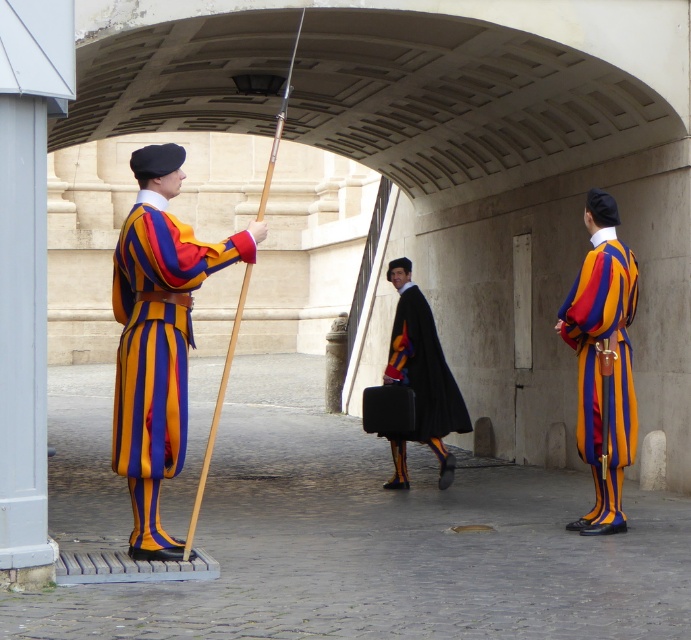
Question: Which point is farther from the camera taking this photo?

Choices:
 (A) (615, 316)
 (B) (117, 474)
 (C) (404, 307)

Answer: (C)

Question: Is striped wool uniform at center above black velvet cape at center?

Choices:
 (A) no
 (B) yes

Answer: (A)

Question: Does striped wool uniform at center have a smaller size compared to striped wool coat at right?

Choices:
 (A) yes
 (B) no

Answer: (A)

Question: Which point is closer to the camera taking this photo?

Choices:
 (A) (577, 348)
 (B) (153, 436)

Answer: (B)

Question: Does striped wool uniform at center have a smaller size compared to striped wool coat at right?

Choices:
 (A) yes
 (B) no

Answer: (A)

Question: Which is nearer to the striped wool uniform at center?

Choices:
 (A) striped wool coat at right
 (B) black velvet cape at center

Answer: (A)